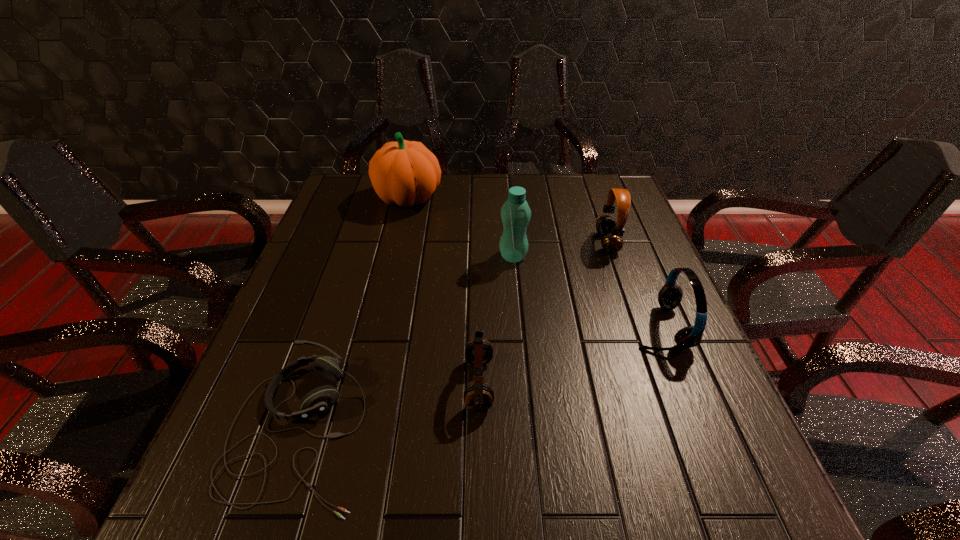
The width and height of the screenshot is (960, 540). Identify the location of vacant space that's between the fifth tallest object and the farthest headset. (543, 313).

You are a GUI agent. You are given a task and a screenshot of the screen. Output one action in this format:
    pyautogui.click(x=<x>, y=<y>)
    Task: Click on the free spot between the shortest headset and the farthest headset
    This screenshot has width=960, height=540.
    Given the screenshot: What is the action you would take?
    pyautogui.click(x=453, y=336)

Where is `vacant point located between the fourth object from right to left and the farthest headset`? The height and width of the screenshot is (540, 960). vacant point located between the fourth object from right to left and the farthest headset is located at coordinates (543, 313).

Where is `vacant space that is in between the shortest headset and the bottle`? vacant space that is in between the shortest headset and the bottle is located at coordinates (406, 343).

Locate an element on the screen. The image size is (960, 540). object that is the closest to the farthest headset is located at coordinates (670, 295).

What are the coordinates of `object that is the second closest to the leftmost headset` in the screenshot? It's located at (515, 213).

The image size is (960, 540). Find the location of `the third closest headset to the pumpkin`. the third closest headset to the pumpkin is located at coordinates (319, 400).

Identify which headset is located as the third nearest to the third object from left to right. Please provide its 2D coordinates. Your answer should be formatted as a tuple, i.e. [(x, y)], where the tuple contains the x and y coordinates of a point satisfying the conditions above.

[(612, 242)]

Where is `vacant space that satisfies the following two spatial constraints: 1. on the front side of the farthest object; 2. on the outer surface of the shortest object`? vacant space that satisfies the following two spatial constraints: 1. on the front side of the farthest object; 2. on the outer surface of the shortest object is located at coordinates click(356, 430).